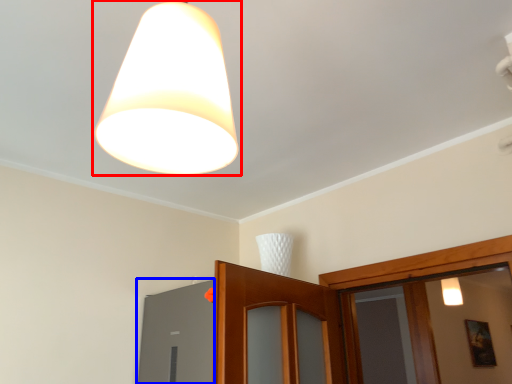
Question: Which of the following is the closest to the observer, lamp (highlighted by a red box) or window (highlighted by a blue box)?

Choices:
 (A) lamp
 (B) window

Answer: (A)